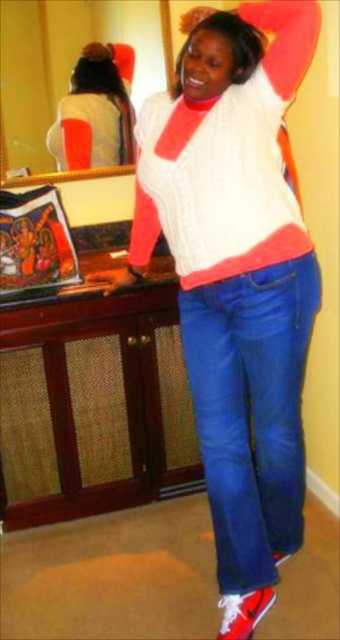
Question: Is denim jeans at lower center positioned at the back of white knit sweater at upper center?

Choices:
 (A) yes
 (B) no

Answer: (B)

Question: Can you confirm if white knit sweater at center is smaller than denim jeans at lower center?

Choices:
 (A) no
 (B) yes

Answer: (A)

Question: Among these points, which one is nearest to the camera?

Choices:
 (A) (275, 300)
 (B) (129, 268)

Answer: (A)

Question: Estimate the real-world distances between objects in this image. Which object is farther from the matte black handbag at lower left?

Choices:
 (A) denim jeans at lower center
 (B) white knit sweater at center
 (C) white knit sweater at upper center

Answer: (A)

Question: Can you confirm if white knit sweater at upper center is positioned to the right of matte black handbag at lower left?

Choices:
 (A) no
 (B) yes

Answer: (A)

Question: Which object is farther from the camera taking this photo?

Choices:
 (A) denim jeans at lower center
 (B) white knit sweater at upper center
 (C) matte black handbag at lower left
 (D) white knit sweater at center

Answer: (B)